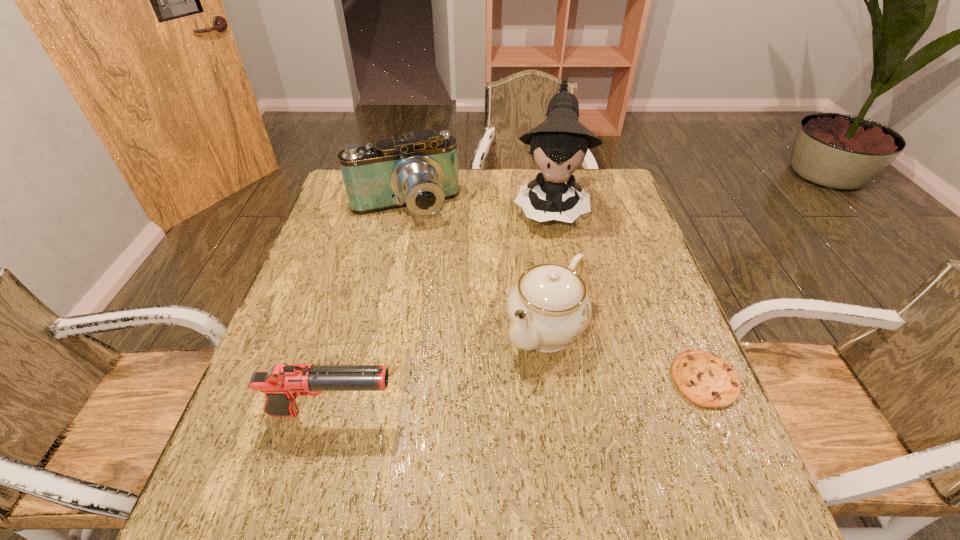
At what (x,y) coordinates should I click in order to perform the action: click on gun. Please return your answer as a coordinate pair (x, y). The height and width of the screenshot is (540, 960). Looking at the image, I should click on (282, 384).

This screenshot has height=540, width=960. I want to click on the shortest object, so click(x=705, y=379).

You are a GUI agent. You are given a task and a screenshot of the screen. Output one action in this format:
    pyautogui.click(x=<x>, y=<y>)
    Task: Click on the cookie
    Image resolution: width=960 pixels, height=540 pixels.
    Given the screenshot: What is the action you would take?
    pyautogui.click(x=705, y=379)

Find the location of a particular element. The height and width of the screenshot is (540, 960). doll is located at coordinates [x=559, y=145].

Image resolution: width=960 pixels, height=540 pixels. Find the location of `chinaware`. chinaware is located at coordinates click(x=548, y=307).

I want to click on camcorder, so click(419, 171).

Locate an element on the screen. vacant space positioned 0.270m at the aiming end of the fourth tallest object is located at coordinates (534, 413).

The height and width of the screenshot is (540, 960). I want to click on vacant area located 0.150m on the back of the shortest object, so click(672, 302).

You are a GUI agent. You are given a task and a screenshot of the screen. Output one action in this format:
    pyautogui.click(x=<x>, y=<y>)
    Task: Click on the vacant space located at the face of the tallest object
    This screenshot has height=540, width=960.
    Given the screenshot: What is the action you would take?
    pyautogui.click(x=548, y=293)

Locate an element on the screen. Image resolution: width=960 pixels, height=540 pixels. vacant space located at the face of the tallest object is located at coordinates (547, 326).